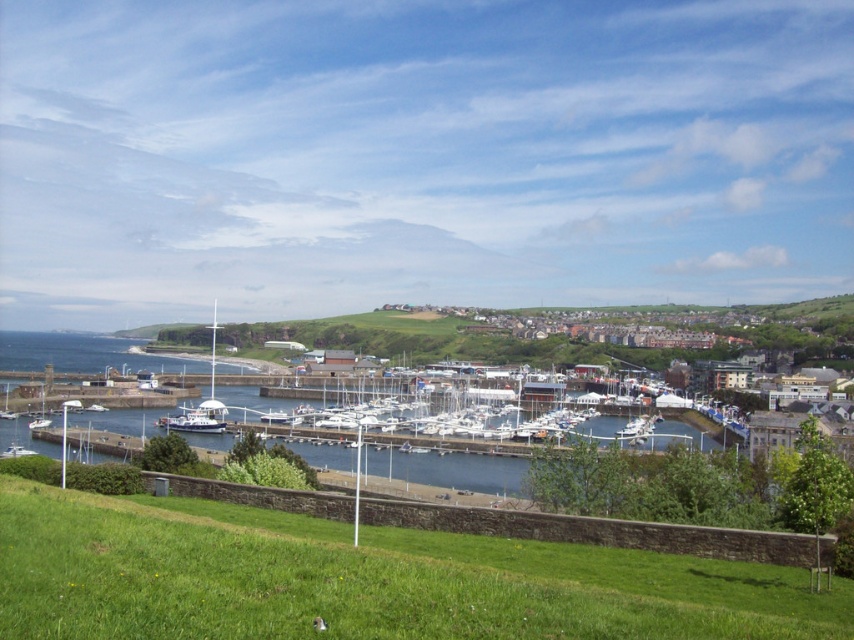
Who is shorter, white glossy boat at center or white glossy boat at lower left?

white glossy boat at center is shorter.

Between white glossy boat at center and white glossy boat at lower left, which one appears on the left side from the viewer's perspective?

white glossy boat at lower left is more to the left.

Locate an element on the screen. white glossy boat at center is located at coordinates (636, 428).

Measure the distance between point (407, 608) and camera.

Point (407, 608) and camera are 25.67 meters apart from each other.

Does green grass at lower left have a greater height compared to white glossy sailboat at lower left?

Yes.

Between point (104, 625) and point (42, 404), which one is positioned behind?

The point (42, 404) is behind.

Where is `green grass at lower left`? Image resolution: width=854 pixels, height=640 pixels. green grass at lower left is located at coordinates (361, 579).

Can you confirm if white glossy boat at center is positioned above white glossy sailboat at lower left?

No.

Is point (639, 436) closer to camera compared to point (45, 417)?

Yes, point (639, 436) is in front of point (45, 417).

Is point (619, 435) closer to viewer compared to point (44, 396)?

That is True.

At what (x,y) coordinates should I click in order to perform the action: click on white glossy boat at center. Please return your answer as a coordinate pair (x, y). Image resolution: width=854 pixels, height=640 pixels. Looking at the image, I should click on (636, 428).